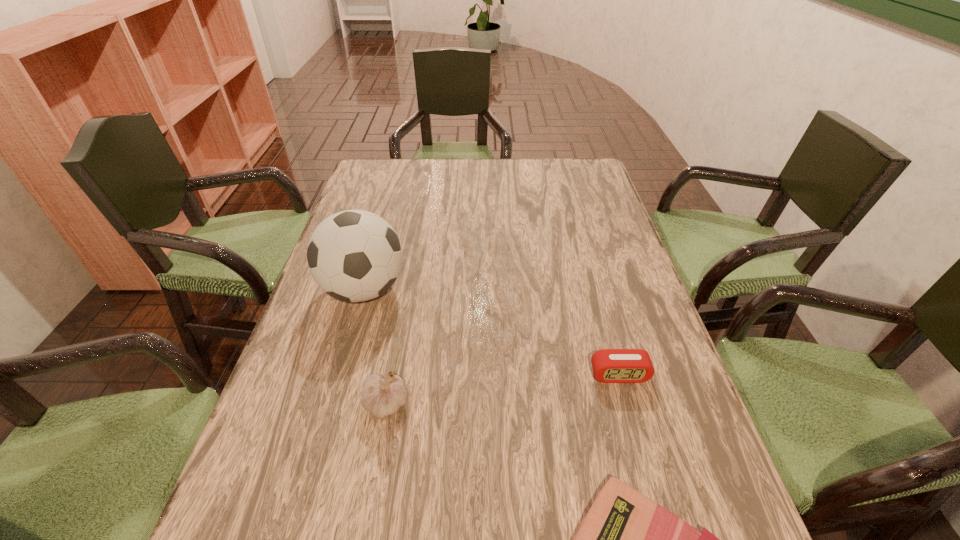
Image resolution: width=960 pixels, height=540 pixels. What are the coordinates of `the tallest object` in the screenshot? It's located at (354, 255).

This screenshot has height=540, width=960. I want to click on soccer ball, so click(x=354, y=255).

What are the coordinates of `the third farthest object` in the screenshot? It's located at (382, 397).

Find the location of a particular element. Image resolution: width=960 pixels, height=540 pixels. the second tallest object is located at coordinates (382, 397).

What are the coordinates of `the third nearest object` in the screenshot? It's located at (609, 365).

What are the coordinates of `alarm clock` in the screenshot? It's located at (609, 365).

The image size is (960, 540). In order to click on vacant region located 0.250m on the front of the soccer ball in this screenshot , I will do `click(327, 420)`.

Where is `vacant region located on the right of the garlic`? The height and width of the screenshot is (540, 960). vacant region located on the right of the garlic is located at coordinates (568, 405).

The image size is (960, 540). I want to click on free space located 0.190m on the front-facing side of the second farthest object, so click(x=648, y=478).

Identify the location of object that is at the left edge. Image resolution: width=960 pixels, height=540 pixels. (354, 255).